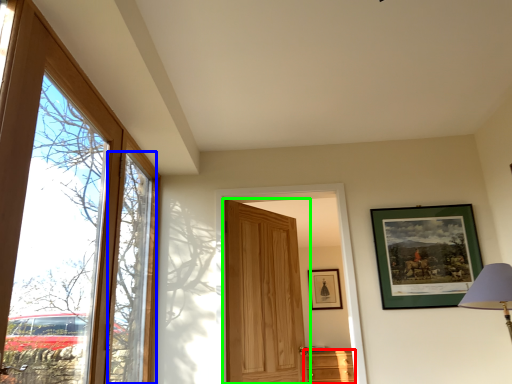
Question: Estimate the real-world distances between objects in this image. Which object is closer to cabinetry (highlighted by a red box), window (highlighted by a blue box) or door (highlighted by a green box)?

Choices:
 (A) window
 (B) door

Answer: (B)